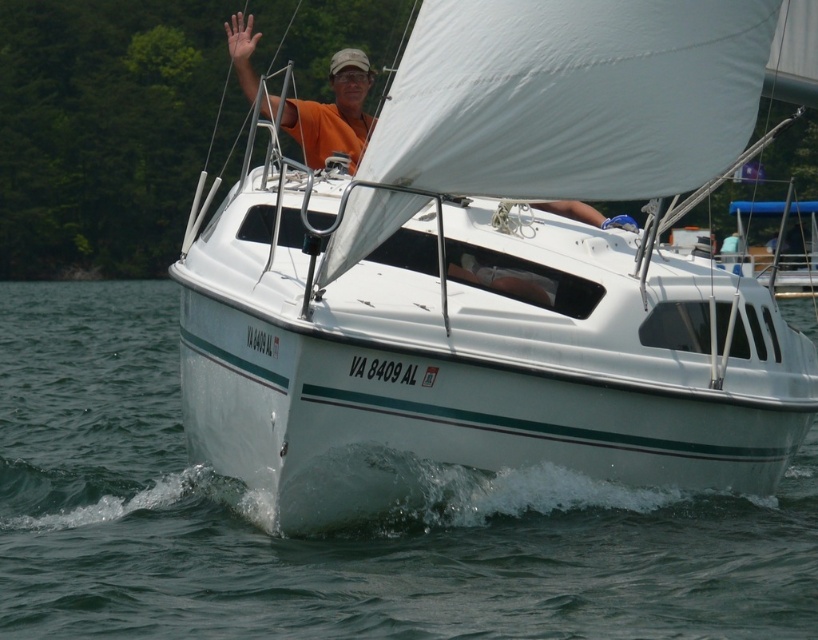
Does clear water at lower center come behind orange fabric shirt at upper center?

No, clear water at lower center is in front of orange fabric shirt at upper center.

Does clear water at lower center have a larger size compared to orange fabric shirt at upper center?

Yes, clear water at lower center is bigger than orange fabric shirt at upper center.

At what (x,y) coordinates should I click in order to perform the action: click on clear water at lower center. Please return your answer as a coordinate pair (x, y). The width and height of the screenshot is (818, 640). Looking at the image, I should click on (340, 528).

At what (x,y) coordinates should I click in order to perform the action: click on clear water at lower center. Please return your answer as a coordinate pair (x, y). The height and width of the screenshot is (640, 818). Looking at the image, I should click on (340, 528).

Locate an element on the screen. white glossy sailboat at center is located at coordinates (500, 272).

Is white glossy sailboat at center in front of orange fabric shirt at upper center?

That is True.

Image resolution: width=818 pixels, height=640 pixels. Describe the element at coordinates (500, 272) in the screenshot. I see `white glossy sailboat at center` at that location.

Identify the location of white glossy sailboat at center. (500, 272).

Is white glossy sailboat at center wider than clear water at lower center?

No.

Can you confirm if white glossy sailboat at center is positioned to the left of clear water at lower center?

Yes, white glossy sailboat at center is to the left of clear water at lower center.

Does point (313, 433) lie in front of point (21, 326)?

Yes, it is in front of point (21, 326).

Where is `white glossy sailboat at center`? Image resolution: width=818 pixels, height=640 pixels. white glossy sailboat at center is located at coordinates (500, 272).